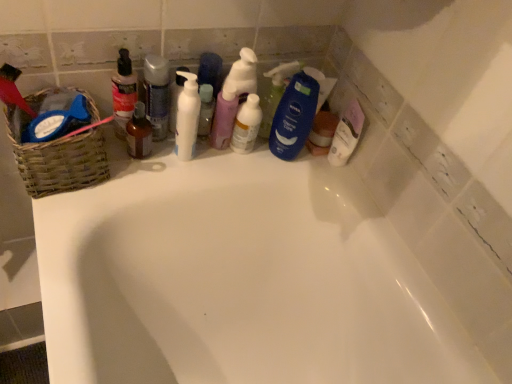
Where is `unoccupied region to the right of brown glass bottle at center`? unoccupied region to the right of brown glass bottle at center is located at coordinates (196, 161).